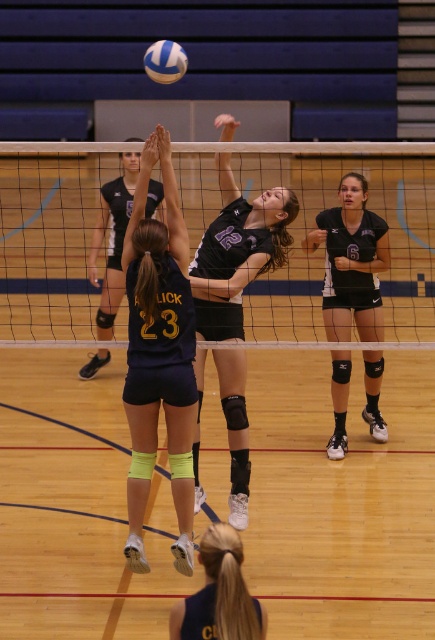
Question: Can you confirm if matte black jersey at center is positioned above white matte volleyball at upper center?

Choices:
 (A) yes
 (B) no

Answer: (B)

Question: Which of the following is the farthest from the observer?

Choices:
 (A) dark blue jersey at center
 (B) black mesh net at center
 (C) black matte uniform at center

Answer: (C)

Question: Does matte black jersey at center appear on the right side of black matte uniform at center?

Choices:
 (A) no
 (B) yes

Answer: (A)

Question: Can you confirm if dark blue jersey at lower center is wider than black jersey at center?

Choices:
 (A) yes
 (B) no

Answer: (B)

Question: Considering the real-world distances, which object is closest to the white matte volleyball at upper center?

Choices:
 (A) black jersey at center
 (B) dark blue jersey at lower center
 (C) black matte uniform at center

Answer: (A)

Question: Which of the following is the closest to the observer?

Choices:
 (A) dark blue jersey at center
 (B) black jersey at center

Answer: (A)